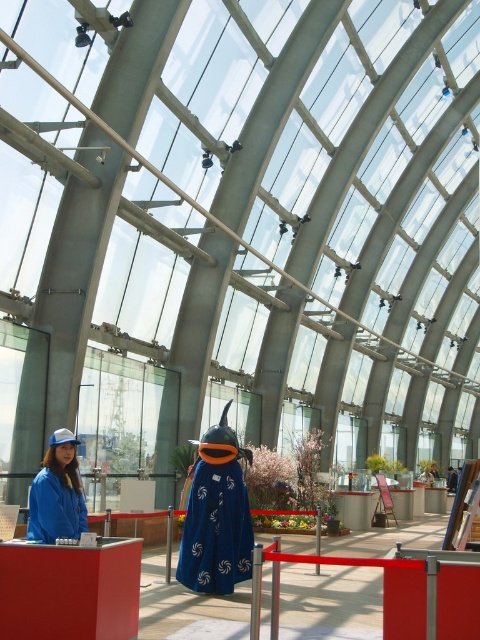
Question: Can you confirm if blue fabric dress at center is smaller than blue fabric jacket at lower left?

Choices:
 (A) yes
 (B) no

Answer: (B)

Question: Is blue fabric dress at center above blue fabric jacket at lower left?

Choices:
 (A) yes
 (B) no

Answer: (B)

Question: Can you confirm if blue fabric dress at center is smaller than blue fabric jacket at lower left?

Choices:
 (A) yes
 (B) no

Answer: (B)